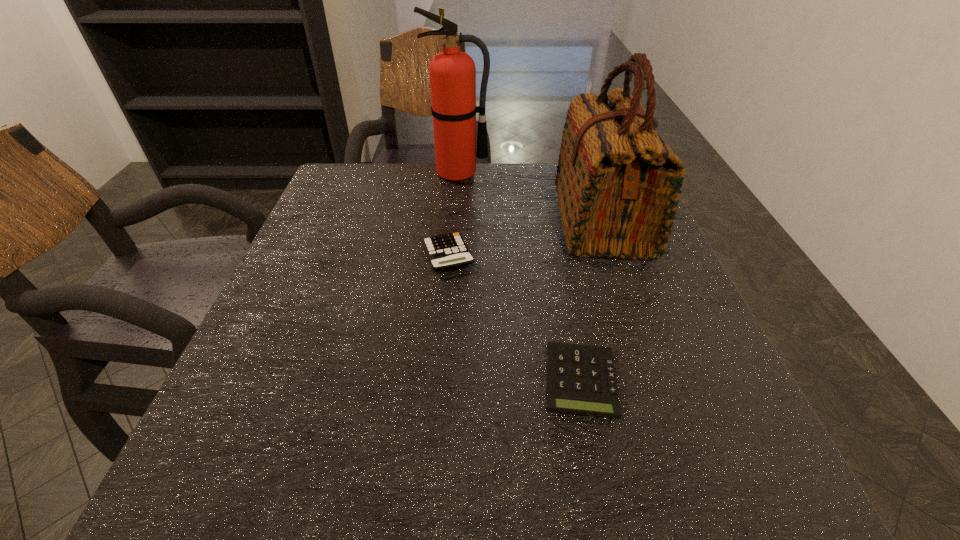
This screenshot has height=540, width=960. What are the coordinates of `vacant point at the far left corner` in the screenshot? It's located at (386, 175).

This screenshot has height=540, width=960. Find the location of `vacant space at the near right corner`. vacant space at the near right corner is located at coordinates (697, 485).

This screenshot has height=540, width=960. Identify the location of unoccupied position between the third tallest object and the nearest object. (515, 319).

Locate an element on the screen. The height and width of the screenshot is (540, 960). free spot between the shopping bag and the left calculator is located at coordinates (525, 238).

In order to click on blank region between the fire extinguisher and the third tallest object in this screenshot , I will do `click(453, 214)`.

Find the location of a particular element. vacant region between the farthest object and the right calculator is located at coordinates (519, 277).

You are a GUI agent. You are given a task and a screenshot of the screen. Output one action in this format:
    pyautogui.click(x=<x>, y=<y>)
    Task: Click on the free space between the fire extinguisher and the nearest object
    The width and height of the screenshot is (960, 540).
    Given the screenshot: What is the action you would take?
    click(519, 277)

The image size is (960, 540). Find the location of `vacant space that's between the shopping bag and the nearer calculator`. vacant space that's between the shopping bag and the nearer calculator is located at coordinates (591, 301).

This screenshot has width=960, height=540. What are the coordinates of `empty space between the right calculator and the shopping bag` in the screenshot? It's located at (591, 301).

Find the location of a particular element. This screenshot has height=540, width=960. empty location between the shopping bag and the shorter calculator is located at coordinates (591, 301).